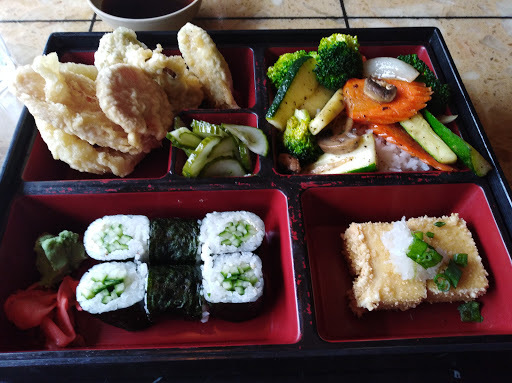
Locate an element on the screen. This screenshot has height=383, width=512. beige panels on the floor is located at coordinates (472, 56).